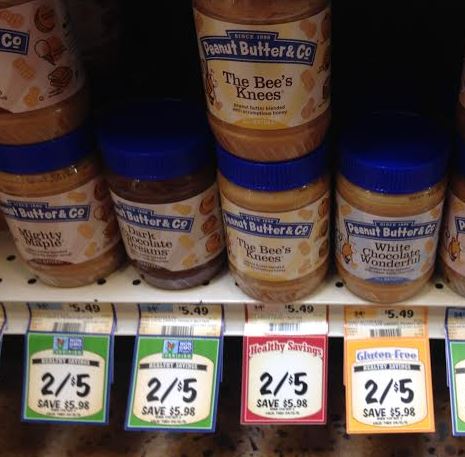
At what (x,y) coordinates should I click in order to perform the action: click on jars. Please return your answer as a coordinate pair (x, y). This screenshot has height=457, width=465. Looking at the image, I should click on coord(40,230), coord(21,74), coord(257,92), coord(177,229), coord(303,255), coord(386,250), coord(451,248).